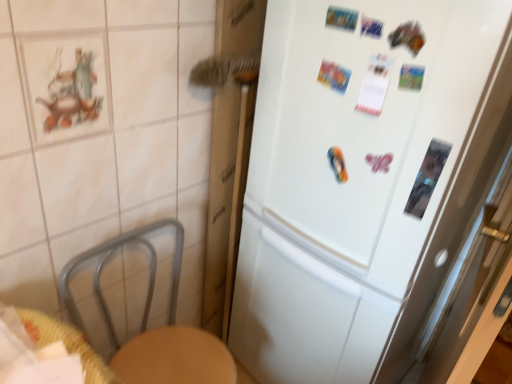
Question: From the image's perspective, is white matte refrigerator at center above woven wood table at lower left?

Choices:
 (A) yes
 (B) no

Answer: (A)

Question: Is white matte refrigerator at center facing away from woven wood table at lower left?

Choices:
 (A) no
 (B) yes

Answer: (A)

Question: Is white matte refrigerator at center far from woven wood table at lower left?

Choices:
 (A) no
 (B) yes

Answer: (A)

Question: Can you confirm if white matte refrigerator at center is bigger than woven wood table at lower left?

Choices:
 (A) no
 (B) yes

Answer: (B)

Question: Is white matte refrigerator at center shorter than woven wood table at lower left?

Choices:
 (A) yes
 (B) no

Answer: (B)

Question: Relative to transparent glass screen door at right, is white matte refrigerator at center in front or behind?

Choices:
 (A) behind
 (B) front

Answer: (A)

Question: From the image's perspective, is white matte refrigerator at center positioned above or below transparent glass screen door at right?

Choices:
 (A) below
 (B) above

Answer: (B)

Question: Is white matte refrigerator at center bigger or smaller than transparent glass screen door at right?

Choices:
 (A) small
 (B) big

Answer: (B)

Question: Is white matte refrigerator at center to the left or to the right of transparent glass screen door at right in the image?

Choices:
 (A) right
 (B) left

Answer: (B)

Question: From a real-world perspective, relative to woven wood table at lower left, is transparent glass screen door at right vertically above or below?

Choices:
 (A) above
 (B) below

Answer: (B)

Question: Considering their positions, is transparent glass screen door at right located in front of or behind woven wood table at lower left?

Choices:
 (A) front
 (B) behind

Answer: (B)

Question: From their relative heights in the image, would you say transparent glass screen door at right is taller or shorter than woven wood table at lower left?

Choices:
 (A) tall
 (B) short

Answer: (A)

Question: Is point (499, 170) closer or farther from the camera than point (32, 327)?

Choices:
 (A) farther
 (B) closer

Answer: (A)

Question: Does point (35, 340) appear closer or farther from the camera than point (334, 44)?

Choices:
 (A) farther
 (B) closer

Answer: (B)

Question: Considering the positions of woven wood table at lower left and white matte refrigerator at center in the image, is woven wood table at lower left wider or thinner than white matte refrigerator at center?

Choices:
 (A) wide
 (B) thin

Answer: (B)